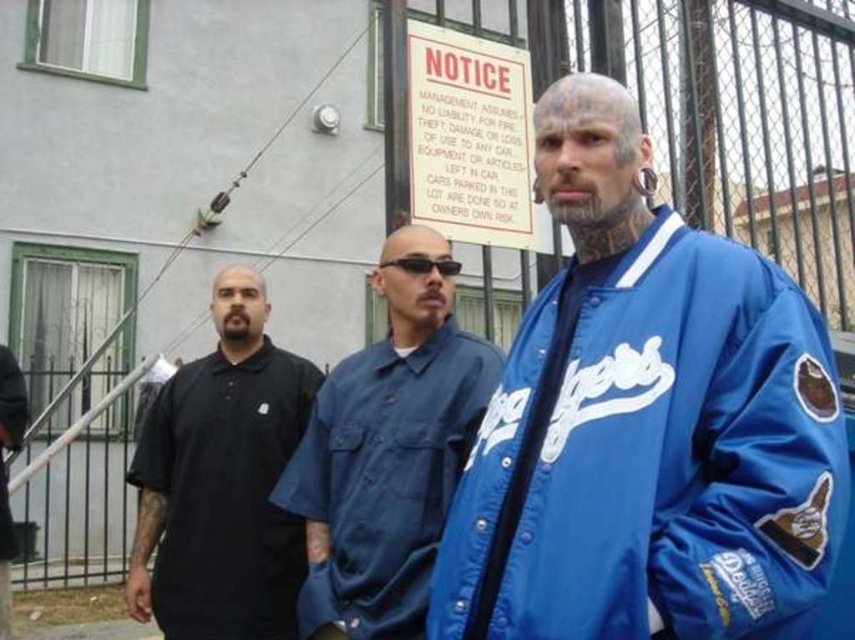
Question: Based on their relative distances, which object is farther from the blue satin jacket at center?

Choices:
 (A) black matte polo shirt at left
 (B) blue denim shirt at center

Answer: (A)

Question: Considering the relative positions of blue satin jacket at center and blue denim shirt at center in the image provided, where is blue satin jacket at center located with respect to blue denim shirt at center?

Choices:
 (A) right
 (B) left

Answer: (A)

Question: Among these points, which one is nearest to the camera?

Choices:
 (A) click(x=795, y=531)
 (B) click(x=146, y=524)

Answer: (A)

Question: Estimate the real-world distances between objects in this image. Which object is closer to the blue satin jacket at center?

Choices:
 (A) black matte polo shirt at left
 (B) blue denim shirt at center

Answer: (B)

Question: Is blue satin jacket at center smaller than black matte polo shirt at left?

Choices:
 (A) yes
 (B) no

Answer: (B)

Question: Does blue satin jacket at center have a greater width compared to blue denim shirt at center?

Choices:
 (A) yes
 (B) no

Answer: (A)